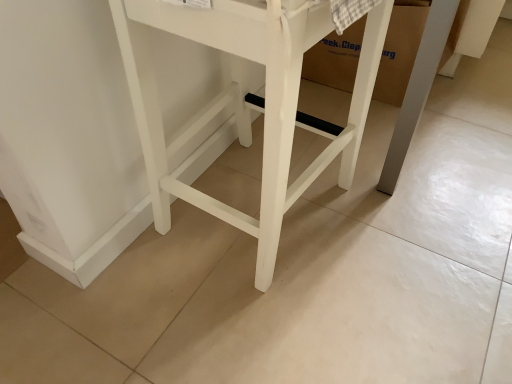
This screenshot has height=384, width=512. Identify the location of empty space that is to the right of white matte stool at center. [x=436, y=247].